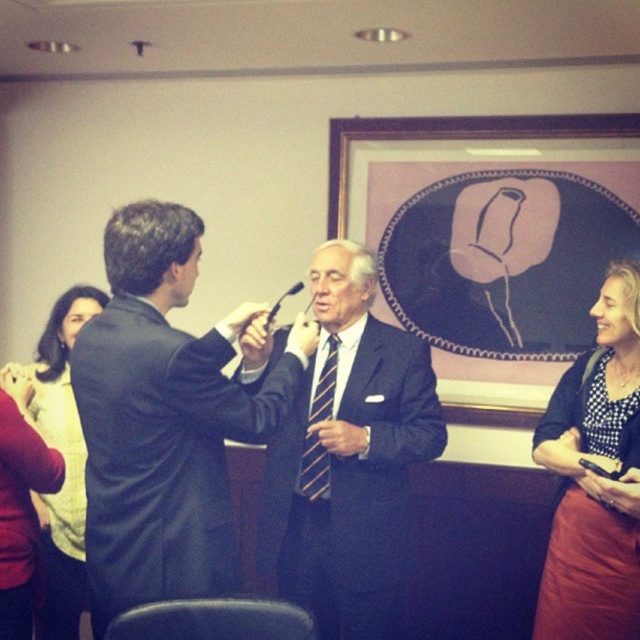
You are a photographer standing at the back of the room. You want to take a photo of the matte yellow sweater at upper left and the woman in red pants at lower right. Can you fit both subjects in the frame if your camera has a 1.8 meter wide field of view?

The matte yellow sweater at upper left and the woman in red pants at lower right are 2.05 meters apart. Since the distance between them exceeds the camera field of view of 1.8 meters, you cannot fit both subjects in the frame.

Based on the scene description, what object is located at the coordinates point (x=490, y=237)?

The point (x=490, y=237) corresponds to the matte black frame at center.

You are a fashion designer observing the scene and want to create a new outfit that combines elements from both the matte yellow sweater at upper left and the striped fabric tie at center. Which item is located to the left of the other to inspire your design placement?

The matte yellow sweater at upper left is positioned on the left side of striped fabric tie at center, so the sweater should be placed to the left of the tie in the design.